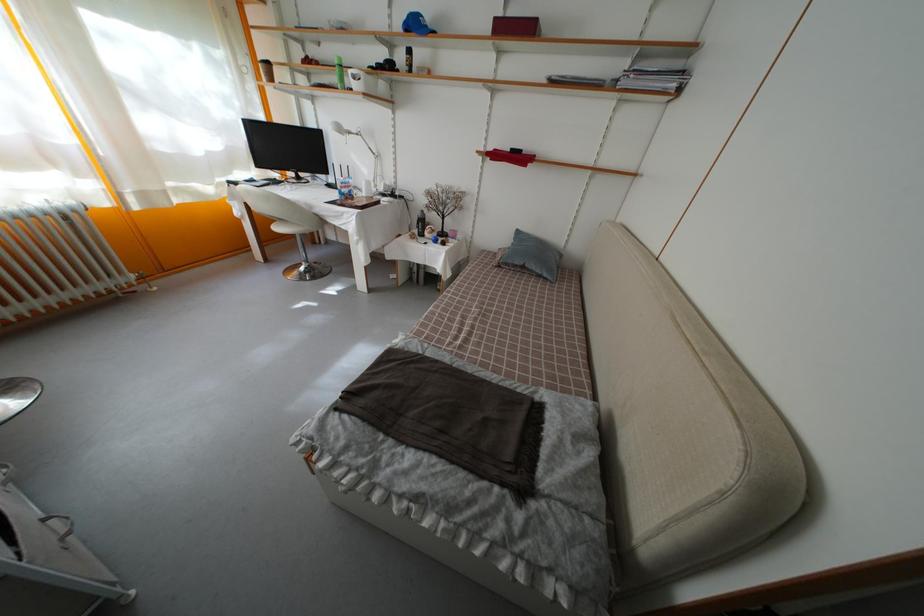
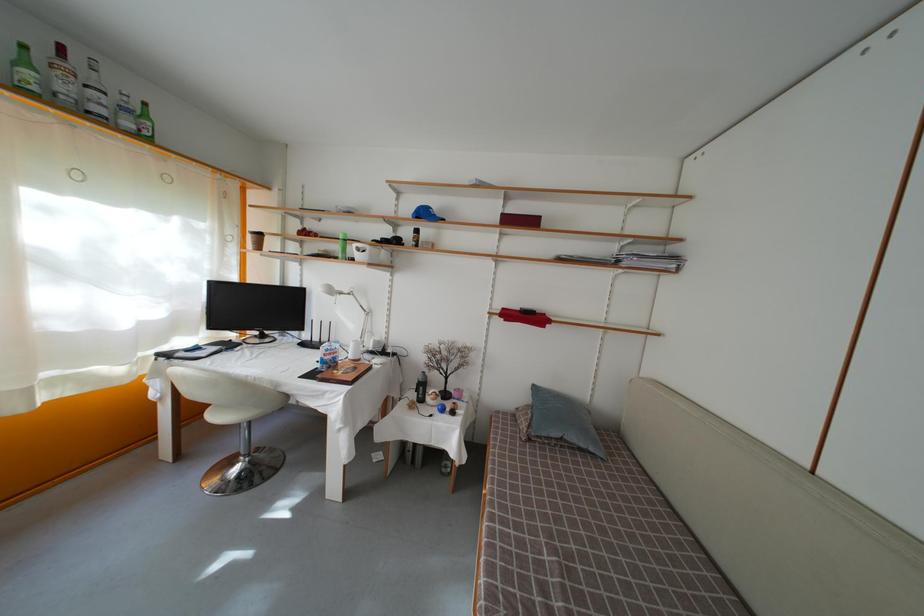
Locate, in the second image, the point that corresponds to pixel 423 233 in the first image.

(422, 397)